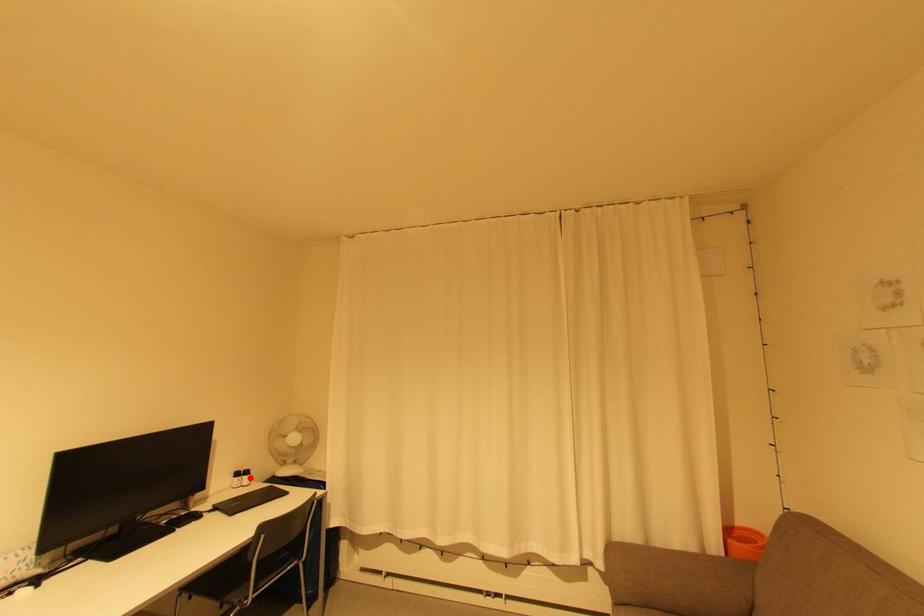
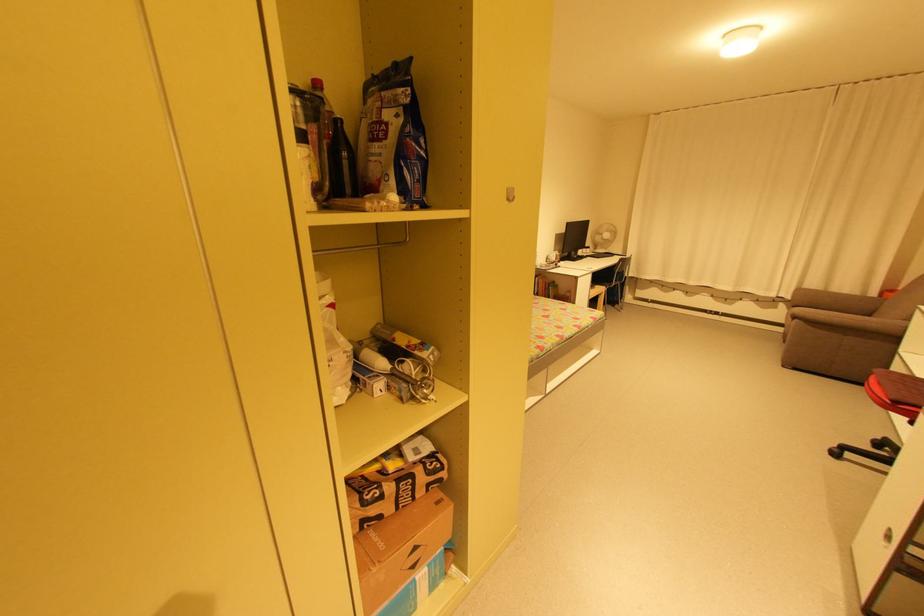
Find the pixel in the second image that matches the highlighted location in the first image.

(592, 249)